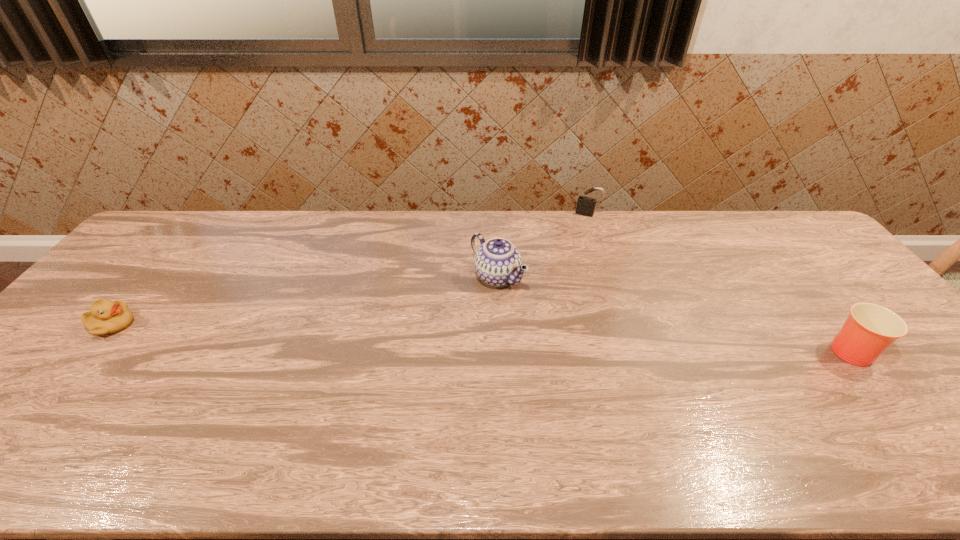
You are a GUI agent. You are given a task and a screenshot of the screen. Output one action in this format:
    pyautogui.click(x=<x>, y=<y>)
    Task: Click on the free space on the desktop that is between the shortest object and the cup and is positioned at the spout of the chinaware
    The image size is (960, 540).
    Given the screenshot: What is the action you would take?
    pyautogui.click(x=395, y=334)

Locate an element on the screen. The width and height of the screenshot is (960, 540). vacant space on the desktop that is between the duckling and the cup and is positioned with the keyhole on the front of the second object from right to left is located at coordinates (533, 338).